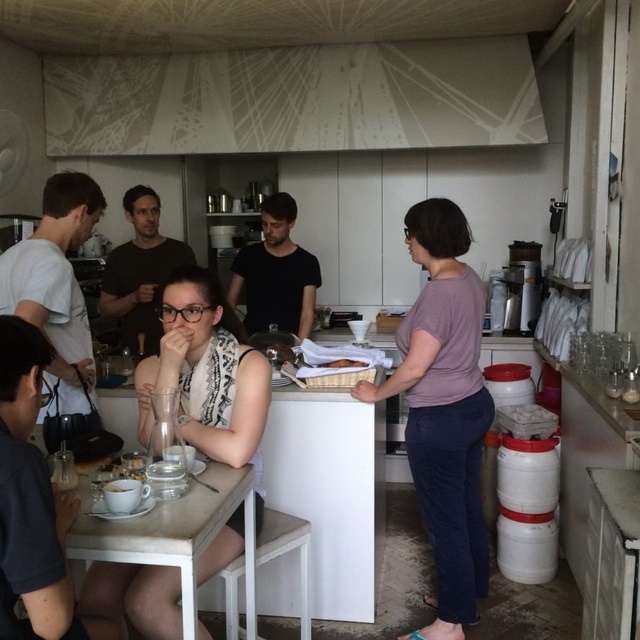
Question: Which of the following is the closest to the observer?

Choices:
 (A) matte silver tray at center
 (B) white matte scarf at center
 (C) purple matte shirt at center
 (D) matte black shirt at center

Answer: (B)

Question: Which of the following is the closest to the observer?

Choices:
 (A) dark gray shirt at lower left
 (B) white matte cup at table left
 (C) white t-shirt at left

Answer: (A)

Question: Considering the relative positions of white matte scarf at center and dark gray shirt at lower left in the image provided, where is white matte scarf at center located with respect to dark gray shirt at lower left?

Choices:
 (A) below
 (B) above

Answer: (A)

Question: Can you confirm if matte black shirt at center is positioned to the left of matte silver tray at center?

Choices:
 (A) yes
 (B) no

Answer: (A)

Question: Based on their relative distances, which object is farther from the matte black shirt at center?

Choices:
 (A) black matte shirt at center
 (B) purple matte shirt at center
 (C) white matte scarf at center

Answer: (B)

Question: Observing the image, what is the correct spatial positioning of purple matte shirt at center in reference to matte silver tray at center?

Choices:
 (A) above
 (B) below

Answer: (B)